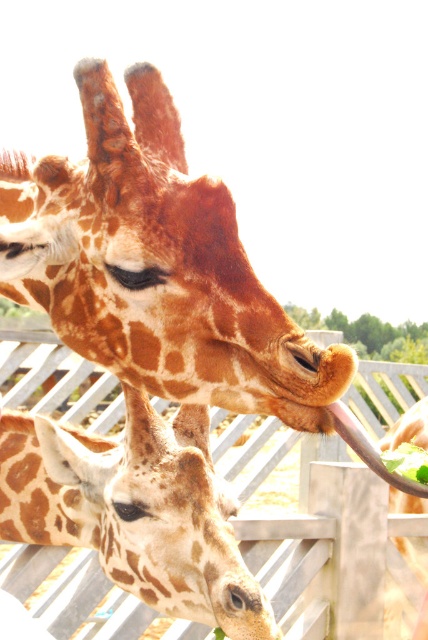
Question: Can you confirm if spotted fur giraffe at center is bigger than green leafy food at lower right?

Choices:
 (A) yes
 (B) no

Answer: (A)

Question: Can you confirm if spotted fur giraffe at center is positioned to the right of green leafy food at lower right?

Choices:
 (A) no
 (B) yes

Answer: (A)

Question: Does spotted fur giraffe at center have a smaller size compared to green leafy food at lower right?

Choices:
 (A) yes
 (B) no

Answer: (B)

Question: Among these objects, which one is nearest to the camera?

Choices:
 (A) spotted fur giraffe at center
 (B) green leafy food at lower right

Answer: (B)